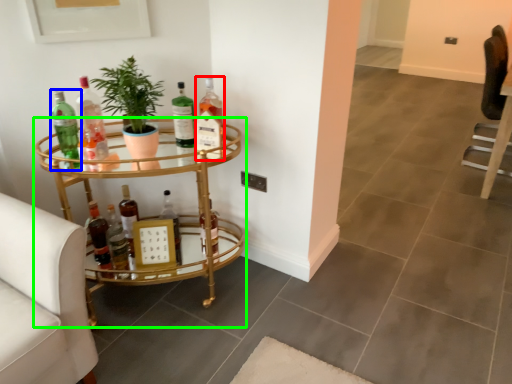
Question: Which object is positioned closest to bottle (highlighted by a red box)? Select from bottle (highlighted by a blue box) and table (highlighted by a green box).

Choices:
 (A) bottle
 (B) table

Answer: (B)